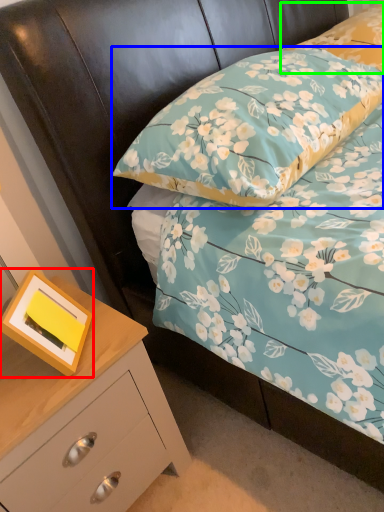
Question: Which object is the farthest from picture frame (highlighted by a red box)? Choose among these: pillow (highlighted by a blue box) or pillow (highlighted by a green box).

Choices:
 (A) pillow
 (B) pillow

Answer: (B)